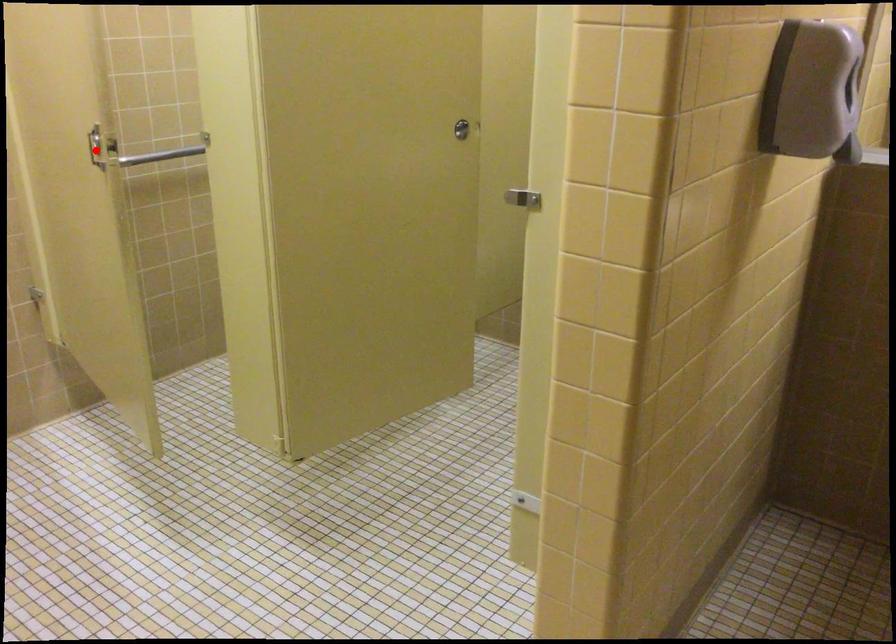
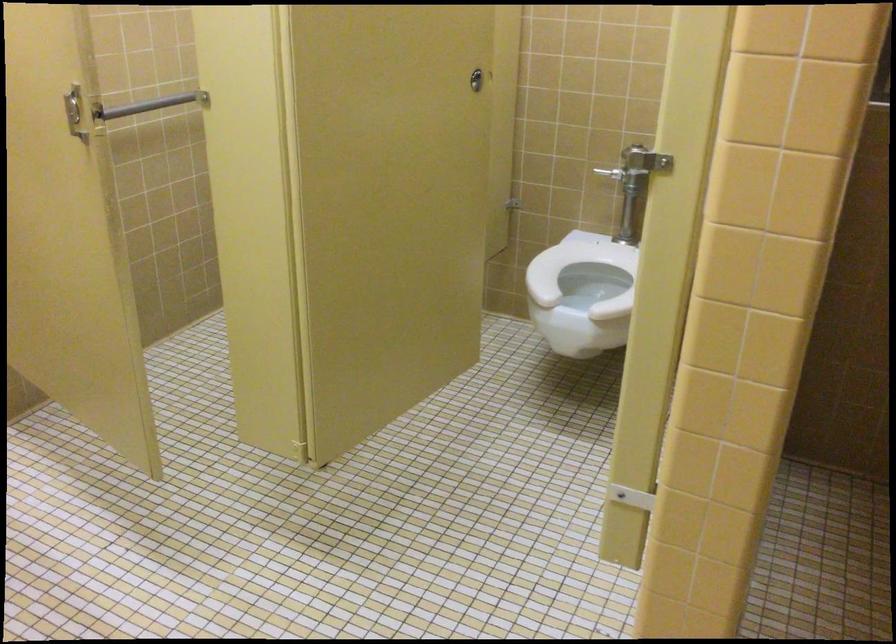
Question: I am providing you with two images of the same scene from different viewpoints. A red point is shown in image1. For the corresponding object point in image2, is it positioned nearer or farther from the camera?

Choices:
 (A) Nearer
 (B) Farther

Answer: (A)